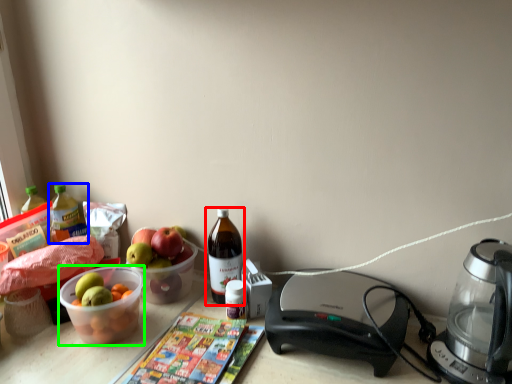
Question: Based on their relative distances, which object is farther from bottle (highlighted by a red box)? Choose from bottle (highlighted by a blue box) and bowl (highlighted by a green box).

Choices:
 (A) bottle
 (B) bowl

Answer: (A)